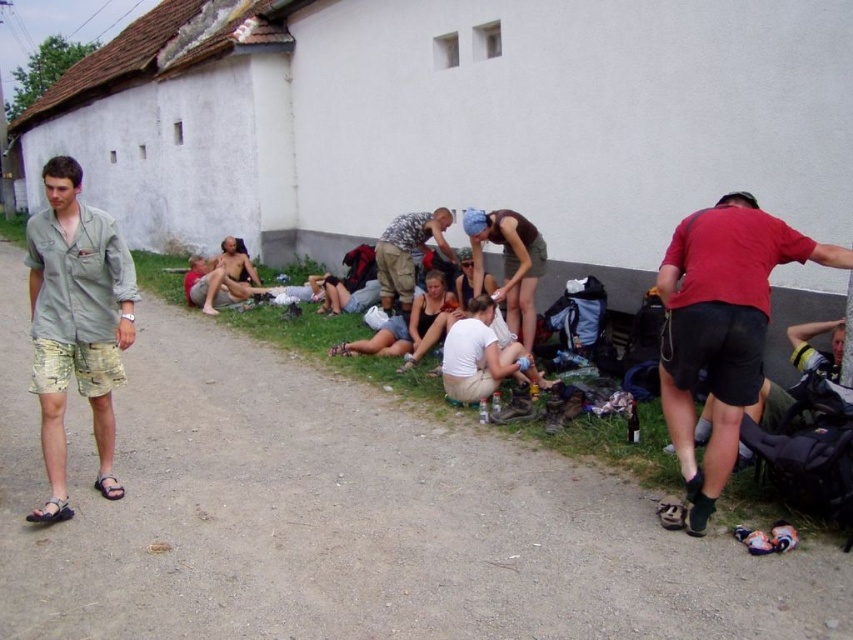
What do you see at coordinates (721, 328) in the screenshot? I see `red matte shirt at lower right` at bounding box center [721, 328].

Where is `red matte shirt at lower right`? The height and width of the screenshot is (640, 853). red matte shirt at lower right is located at coordinates (721, 328).

Is light green cotton shirt at left to the left of black leather sandal at lower left from the viewer's perspective?

In fact, light green cotton shirt at left is to the right of black leather sandal at lower left.

Based on the photo, does light green cotton shirt at left appear on the right side of black leather sandal at lower left?

Indeed, light green cotton shirt at left is positioned on the right side of black leather sandal at lower left.

The height and width of the screenshot is (640, 853). Identify the location of light green cotton shirt at left. (76, 314).

Consider the image. Can you confirm if camouflage fabric shirt at center is positioned below brown leather sandal at lower left?

No, camouflage fabric shirt at center is not below brown leather sandal at lower left.

Can you confirm if camouflage fabric shirt at center is taller than brown leather sandal at lower left?

Indeed, camouflage fabric shirt at center has a greater height compared to brown leather sandal at lower left.

Which is behind, point (410, 284) or point (97, 474)?

Positioned behind is point (410, 284).

This screenshot has width=853, height=640. What are the coordinates of `camouflage fabric shirt at center` in the screenshot? It's located at (407, 252).